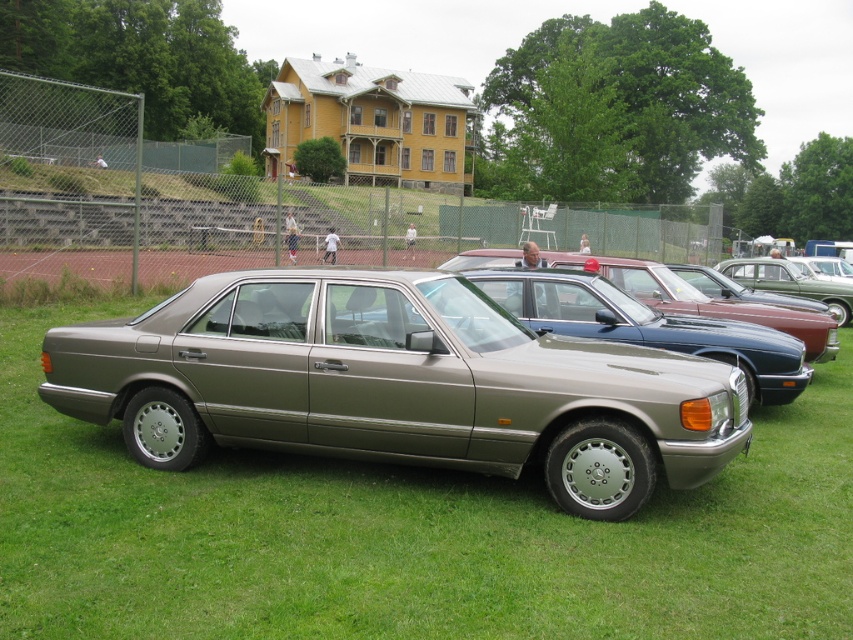
Question: Considering the real-world distances, which object is closest to the metallic red car at center?

Choices:
 (A) satin metallic sedan at center
 (B) satin silver car at center

Answer: (B)

Question: Which of the following is the closest to the observer?

Choices:
 (A) satin silver car at center
 (B) metallic red car at center
 (C) satin metallic sedan at center

Answer: (C)

Question: Considering the relative positions of satin metallic sedan at center and metallic red car at center in the image provided, where is satin metallic sedan at center located with respect to metallic red car at center?

Choices:
 (A) right
 (B) left

Answer: (B)

Question: Can you confirm if satin metallic sedan at center is positioned to the right of metallic red car at center?

Choices:
 (A) no
 (B) yes

Answer: (A)

Question: Which point is farther from the camera taking this photo?

Choices:
 (A) (463, 266)
 (B) (450, 349)

Answer: (A)

Question: Can you confirm if satin metallic sedan at center is smaller than satin silver car at center?

Choices:
 (A) no
 (B) yes

Answer: (A)